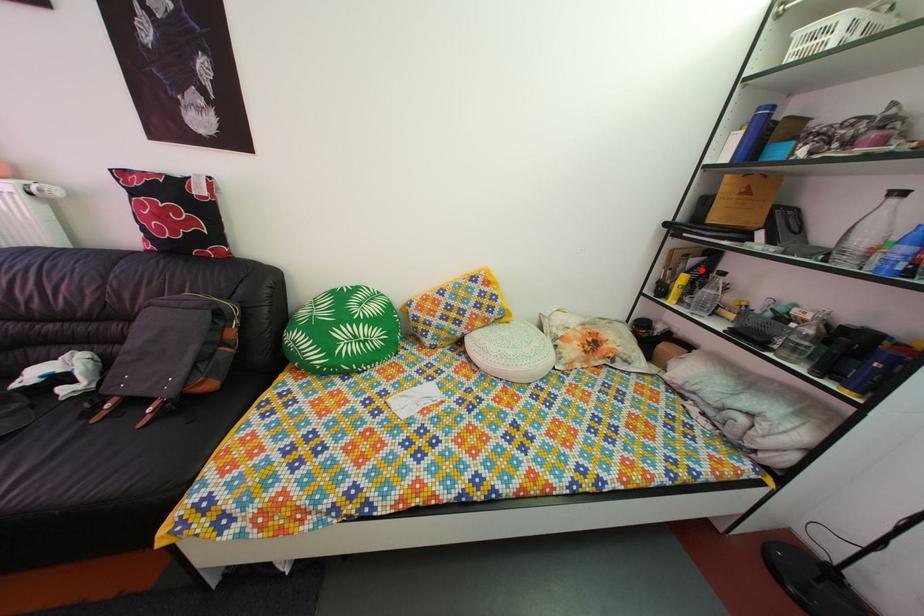
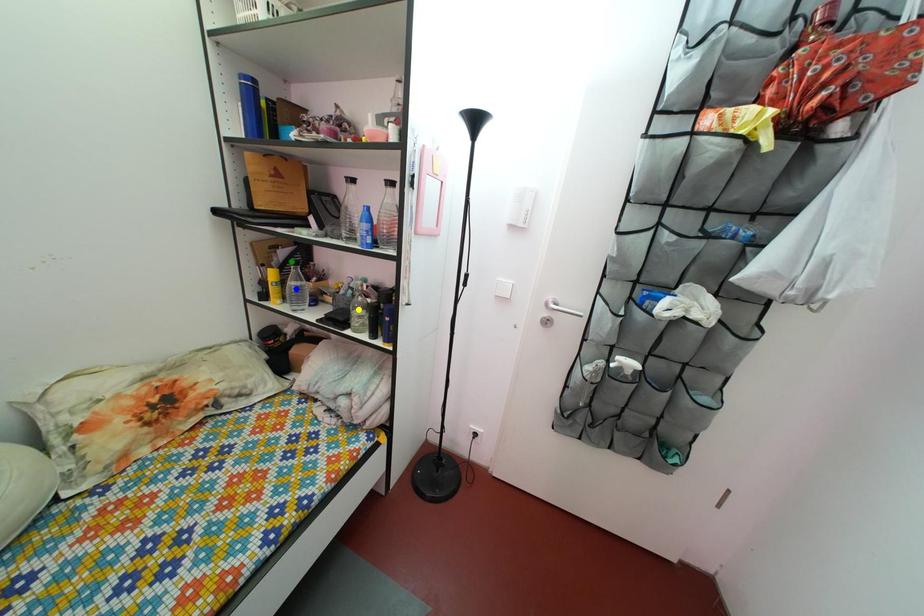
Question: I am providing you with two images of the same scene from different viewpoints. A red point is marked on the first image. You are given multiple points on the second image. Which point in image 2 represents the same 3d spot as the red point in image 1?

Choices:
 (A) yellow point
 (B) green point
 (C) blue point

Answer: (B)